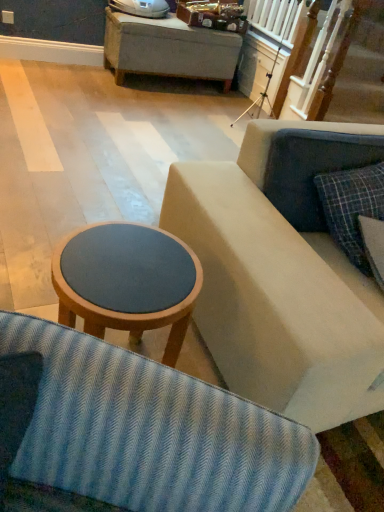
The width and height of the screenshot is (384, 512). Describe the element at coordinates (352, 207) in the screenshot. I see `plaid fabric pillow at right` at that location.

You are a GUI agent. You are given a task and a screenshot of the screen. Output one action in this format:
    pyautogui.click(x=<x>, y=<y>)
    Task: Click on the plaid fabric pillow at right
    Image resolution: width=384 pixels, height=512 pixels.
    Given the screenshot: What is the action you would take?
    pyautogui.click(x=352, y=207)

Image resolution: width=384 pixels, height=512 pixels. Find the location of `matte wood stool at center`. matte wood stool at center is located at coordinates (x=127, y=282).

Describe the element at coordinates (127, 282) in the screenshot. The width and height of the screenshot is (384, 512). I see `matte wood stool at center` at that location.

Where is `plaid fabric pillow at right`? The width and height of the screenshot is (384, 512). plaid fabric pillow at right is located at coordinates (352, 207).

Visually, is matte wood stool at center positioned to the left or to the right of plaid fabric pillow at right?

Based on their positions, matte wood stool at center is located to the left of plaid fabric pillow at right.

Is matte wood stool at center positioned in front of plaid fabric pillow at right?

Yes, it is.

Is point (136, 228) closer or farther from the camera than point (356, 266)?

Point (136, 228).

From the image's perspective, who appears lower, matte wood stool at center or plaid fabric pillow at right?

matte wood stool at center is shown below in the image.

From a real-world perspective, does matte wood stool at center stand above plaid fabric pillow at right?

No, from a real-world perspective, matte wood stool at center is not on top of plaid fabric pillow at right.

Considering the sizes of objects matte wood stool at center and plaid fabric pillow at right in the image provided, who is thinner, matte wood stool at center or plaid fabric pillow at right?

plaid fabric pillow at right is thinner.

Can you confirm if matte wood stool at center is shorter than plaid fabric pillow at right?

No.

Considering the sizes of objects matte wood stool at center and plaid fabric pillow at right in the image provided, who is smaller, matte wood stool at center or plaid fabric pillow at right?

With smaller size is plaid fabric pillow at right.

Is plaid fabric pillow at right located within matte wood stool at center?

No, plaid fabric pillow at right is located outside of matte wood stool at center.

Is matte wood stool at center touching plaid fabric pillow at right?

No, matte wood stool at center is not in contact with plaid fabric pillow at right.

Is matte wood stool at center positioned with its back to plaid fabric pillow at right?

No, matte wood stool at center's orientation is not away from plaid fabric pillow at right.

How different are the orientations of matte wood stool at center and plaid fabric pillow at right in degrees?

1.09 degrees.

How far apart are matte wood stool at center and plaid fabric pillow at right?

31.38 inches.

The width and height of the screenshot is (384, 512). Identify the location of pillow that appears above the matte wood stool at center (from a real-world perspective). (352, 207).

Is plaid fabric pillow at right to the right of matte wood stool at center from the viewer's perspective?

Yes, plaid fabric pillow at right is to the right of matte wood stool at center.

Considering the relative positions of plaid fabric pillow at right and matte wood stool at center in the image provided, is plaid fabric pillow at right behind matte wood stool at center?

Yes, plaid fabric pillow at right is further from the camera.

Which is in front, point (357, 213) or point (88, 301)?

The point (88, 301) is in front.

In the scene shown: From the image's perspective, is plaid fabric pillow at right on matte wood stool at center?

Yes, from the image's perspective, plaid fabric pillow at right is over matte wood stool at center.

From a real-world perspective, is plaid fabric pillow at right positioned under matte wood stool at center based on gravity?

No, from a real-world perspective, plaid fabric pillow at right is not beneath matte wood stool at center.

Looking at this image, between plaid fabric pillow at right and matte wood stool at center, which one has smaller width?

Thinner between the two is plaid fabric pillow at right.

Considering the relative sizes of plaid fabric pillow at right and matte wood stool at center in the image provided, is plaid fabric pillow at right shorter than matte wood stool at center?

Yes.

Can you confirm if plaid fabric pillow at right is bigger than matte wood stool at center?

No, plaid fabric pillow at right is not bigger than matte wood stool at center.

Is matte wood stool at center completely or partially inside plaid fabric pillow at right?

No, matte wood stool at center is not a part of plaid fabric pillow at right.

Is plaid fabric pillow at right far from matte wood stool at center?

No, plaid fabric pillow at right is not far from matte wood stool at center.

Could you tell me if plaid fabric pillow at right is turned towards matte wood stool at center?

No, plaid fabric pillow at right does not turn towards matte wood stool at center.

In order to click on table directly beneath the plaid fabric pillow at right (from a real-world perspective) in this screenshot , I will do `click(127, 282)`.

I want to click on table on the left of plaid fabric pillow at right, so click(x=127, y=282).

Image resolution: width=384 pixels, height=512 pixels. There is a matte wood stool at center. Identify the location of pillow above it (from a real-world perspective). (352, 207).